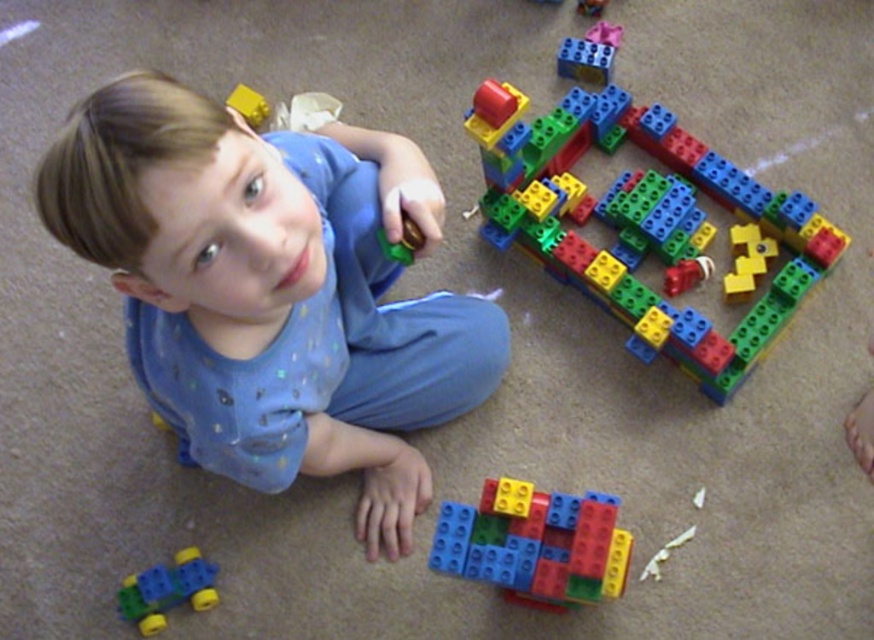
You are a parent trying to locate two specific points in the image of your child playing with blocks. The first point is at coordinates point (271, 195) and the second is at point (754, 330). Which point is nearer to you?

Point (271, 195) is closer to the viewer than point (754, 330).

You are a parent trying to clean up the play area. You see the point marked at coordinates (533, 545) which marks the location of multicolored plastic blocks at center. If you move the blocks to the left side of the room, will they be closer to the child or farther away?

The point at (533, 545) marks the location of multicolored plastic blocks at center. Moving them to the left side of the room would place them farther away from the child, who is at the center of the scene.

You are a parent trying to clean up the playroom. You see the blue cotton toddler at upper left and the multicolored plastic blocks at center. Can you pick up the blocks without moving closer than 12 inches to the toddler?

The distance between the blue cotton toddler at upper left and the multicolored plastic blocks at center is 12.39 inches. Since 12.39 inches is slightly more than 12 inches, you can pick up the blocks without moving closer than 12 inches to the toddler.